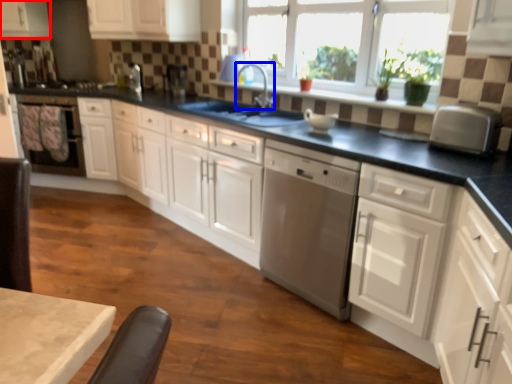
Question: Which of the following is the closest to the observer, cabinetry (highlighted by a red box) or faucet (highlighted by a blue box)?

Choices:
 (A) cabinetry
 (B) faucet

Answer: (B)